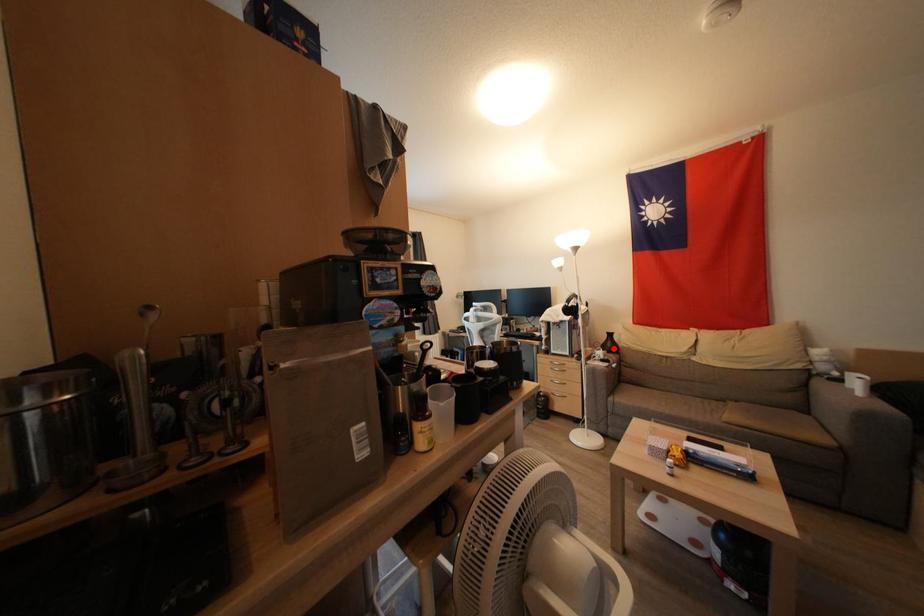
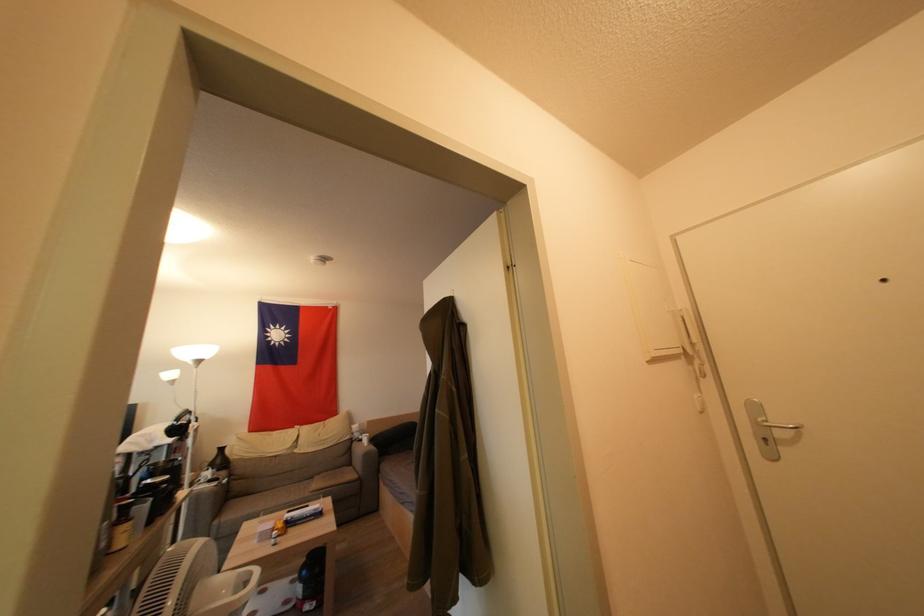
Find the pixel in the second image that matches the highlighted location in the first image.

(224, 464)